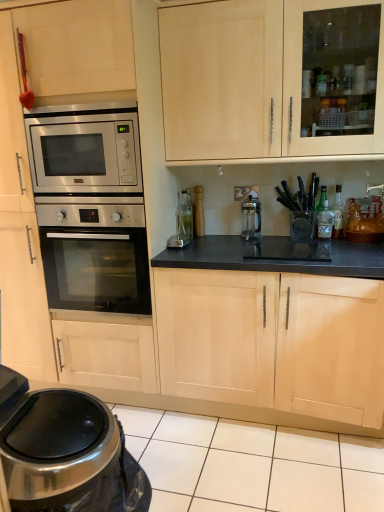
Question: Can you confirm if metallic trash can at lower left is thinner than satin silver coffee maker at center?

Choices:
 (A) yes
 (B) no

Answer: (B)

Question: Does metallic trash can at lower left appear on the left side of satin silver coffee maker at center?

Choices:
 (A) no
 (B) yes

Answer: (B)

Question: Considering the relative sizes of metallic trash can at lower left and satin silver coffee maker at center in the image provided, is metallic trash can at lower left bigger than satin silver coffee maker at center?

Choices:
 (A) yes
 (B) no

Answer: (A)

Question: From a real-world perspective, is metallic trash can at lower left on satin silver coffee maker at center?

Choices:
 (A) yes
 (B) no

Answer: (B)

Question: Can you confirm if metallic trash can at lower left is wider than satin silver coffee maker at center?

Choices:
 (A) no
 (B) yes

Answer: (B)

Question: Visually, is satin silver coffee maker at center positioned to the left or to the right of stainless steel oven at left?

Choices:
 (A) right
 (B) left

Answer: (A)

Question: From their relative heights in the image, would you say satin silver coffee maker at center is taller or shorter than stainless steel oven at left?

Choices:
 (A) short
 (B) tall

Answer: (A)

Question: Is satin silver coffee maker at center situated inside stainless steel oven at left or outside?

Choices:
 (A) inside
 (B) outside

Answer: (B)

Question: From the image's perspective, is satin silver coffee maker at center positioned above or below stainless steel oven at left?

Choices:
 (A) below
 (B) above

Answer: (B)

Question: Which is correct: clear glass bottle at center-right, the second bottle positioned from the left, is inside clear glass bottle at center-right, the third bottle when ordered from right to left, or outside of it?

Choices:
 (A) inside
 (B) outside

Answer: (B)

Question: Does point (317, 224) appear closer or farther from the camera than point (317, 224)?

Choices:
 (A) farther
 (B) closer

Answer: (A)

Question: Relative to clear glass bottle at center-right, the third bottle when ordered from right to left, is clear glass bottle at center-right, acting as the second bottle starting from the right, in front or behind?

Choices:
 (A) behind
 (B) front

Answer: (A)

Question: Is clear glass bottle at center-right, acting as the second bottle starting from the right, bigger or smaller than clear glass bottle at center-right, the third bottle when ordered from right to left?

Choices:
 (A) small
 (B) big

Answer: (B)

Question: Considering the positions of stainless steel microwave oven at left and clear glass bottle at center-right, acting as the second bottle starting from the right, in the image, is stainless steel microwave oven at left bigger or smaller than clear glass bottle at center-right, acting as the second bottle starting from the right,?

Choices:
 (A) small
 (B) big

Answer: (B)

Question: From a real-world perspective, is stainless steel microwave oven at left above or below clear glass bottle at center-right, acting as the second bottle starting from the right?

Choices:
 (A) below
 (B) above

Answer: (B)